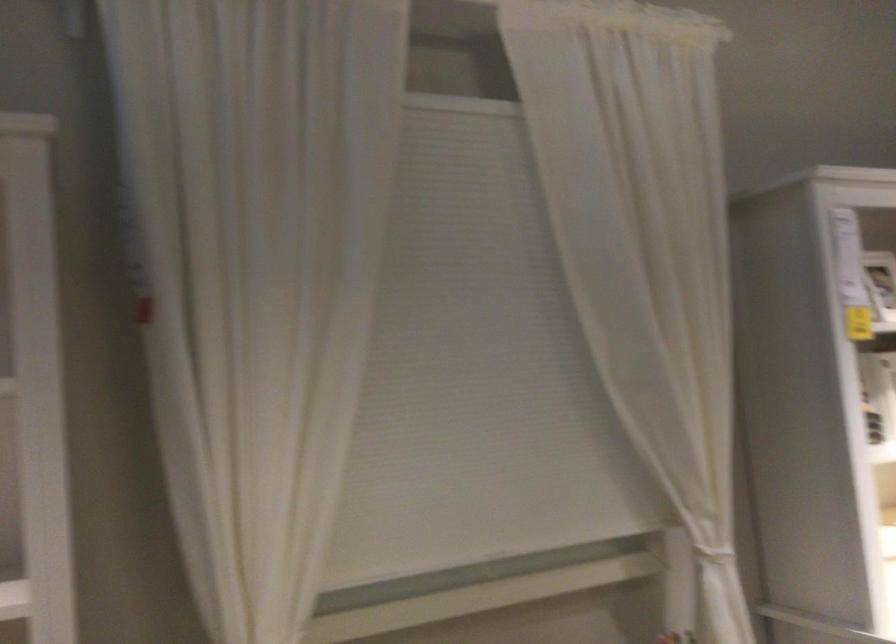
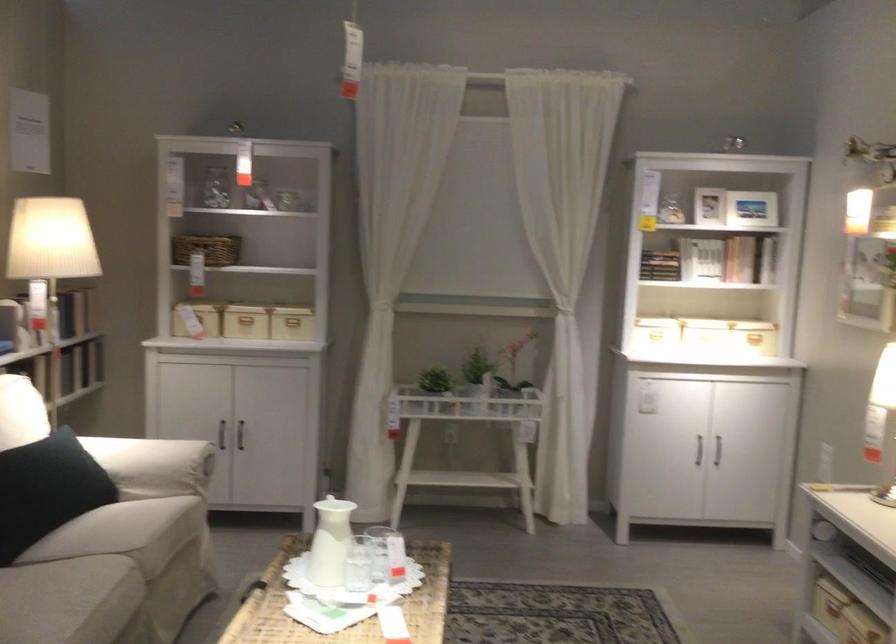
Find the pixel in the second image that matches pixel 816 453 in the first image.

(659, 265)